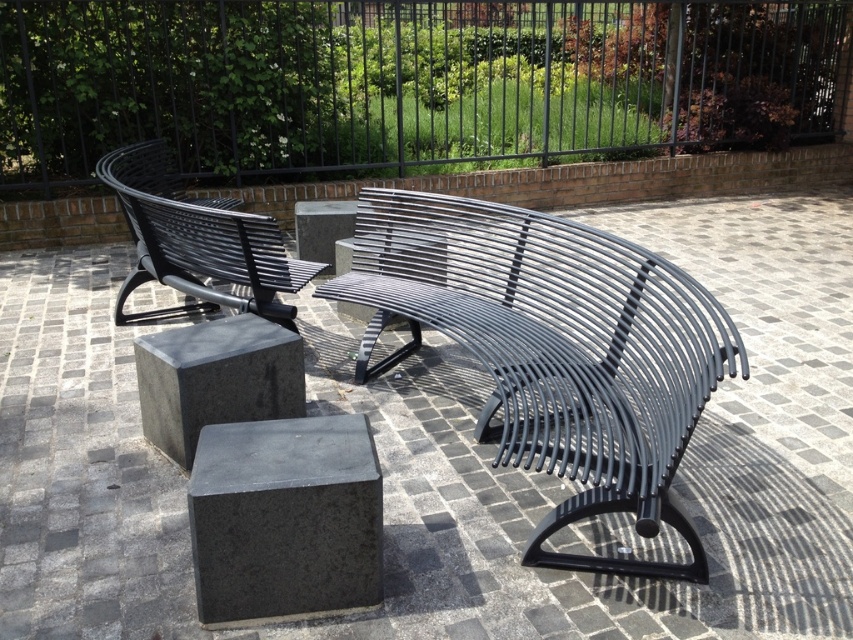
Question: Is black metal bench at center behind black metal bench at left?

Choices:
 (A) no
 (B) yes

Answer: (A)

Question: Based on their relative distances, which object is farther from the black metal fence at upper center?

Choices:
 (A) black metal bench at center
 (B) gray concrete block at center
 (C) black metal bench at left

Answer: (B)

Question: Can you confirm if black metal fence at upper center is smaller than black metal bench at center?

Choices:
 (A) no
 (B) yes

Answer: (A)

Question: Is gray granite cube at center positioned behind gray concrete block at center?

Choices:
 (A) no
 (B) yes

Answer: (B)

Question: Estimate the real-world distances between objects in this image. Which object is closer to the black metal fence at upper center?

Choices:
 (A) black metal bench at left
 (B) gray granite cube at center
 (C) gray polished concrete at center

Answer: (A)

Question: Which point appears closest to the camera in this image?

Choices:
 (A) (106, 480)
 (B) (165, 444)

Answer: (A)